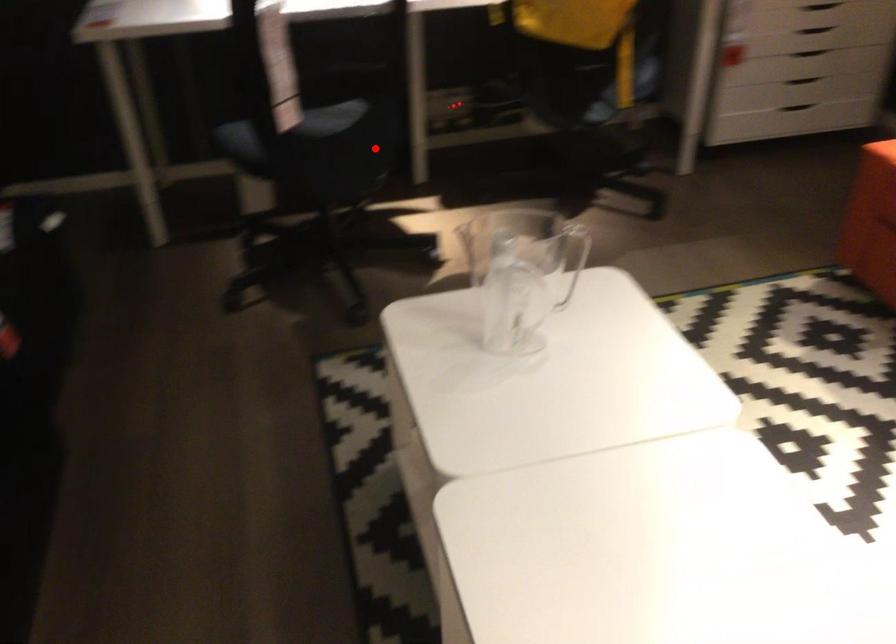
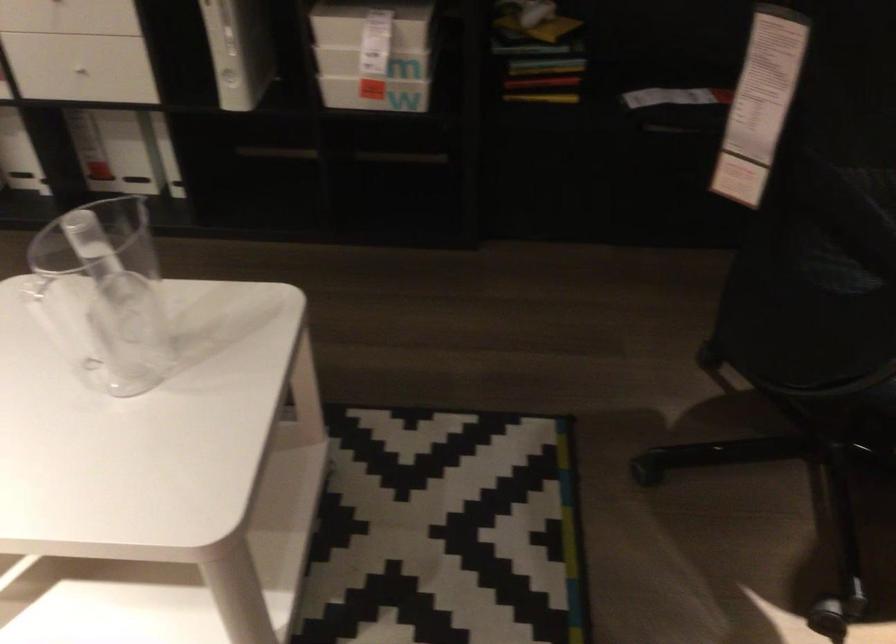
The point at the highlighted location is marked in the first image. Where is the corresponding point in the second image?

(837, 364)